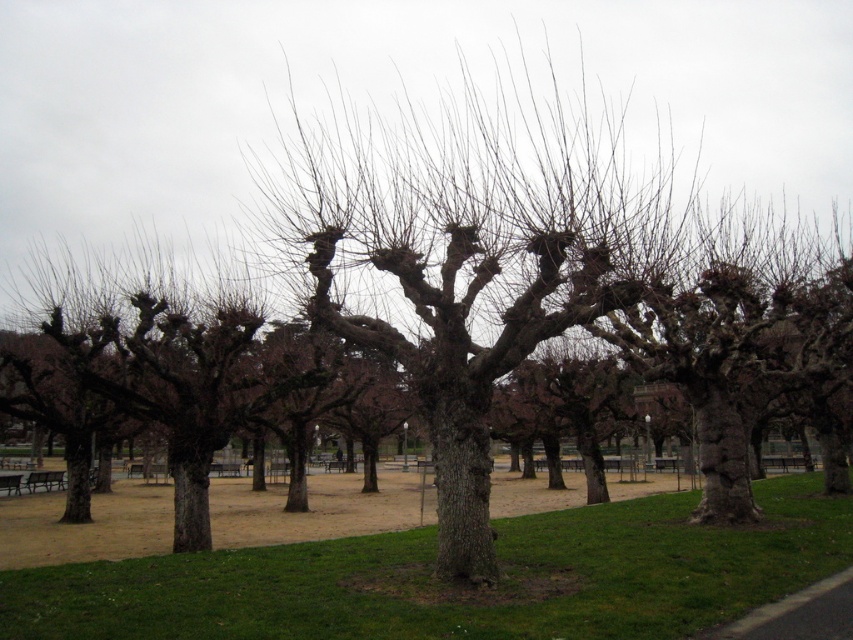
Measure the distance between point (328, 326) and camera.

A distance of 27.93 feet exists between point (328, 326) and camera.

This screenshot has width=853, height=640. I want to click on bark textured tree at center, so click(471, 256).

Locate an element on the screen. This screenshot has height=640, width=853. bark textured tree at center is located at coordinates (471, 256).